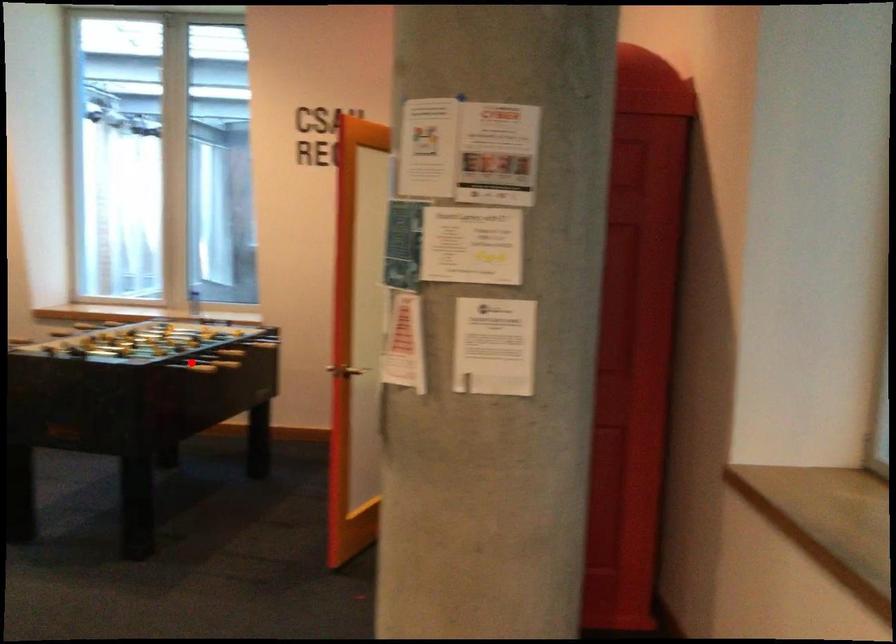
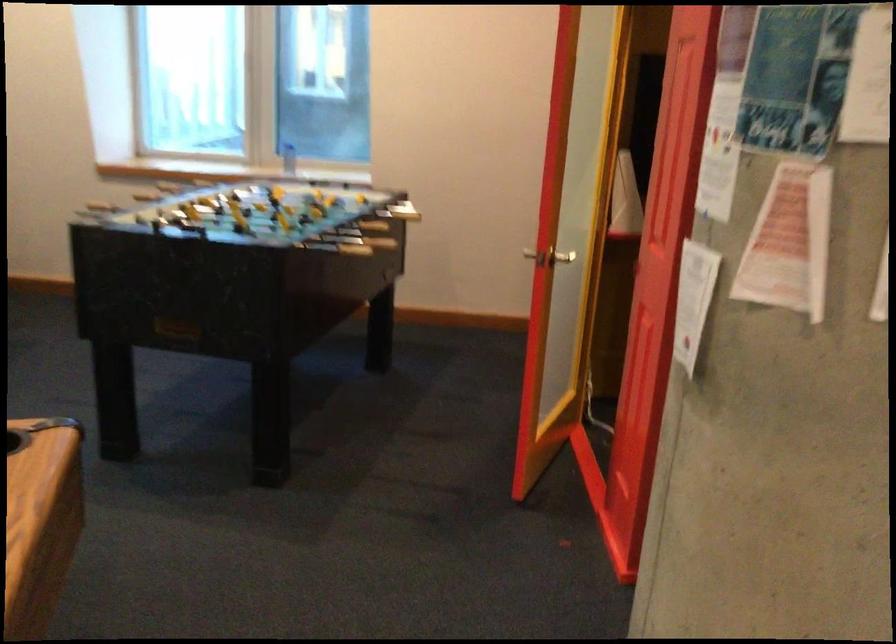
Question: I am providing you with two images of the same scene from different viewpoints. A red point is shown in image1. For the corresponding object point in image2, is it positioned nearer or farther from the camera?

Choices:
 (A) Nearer
 (B) Farther

Answer: (A)